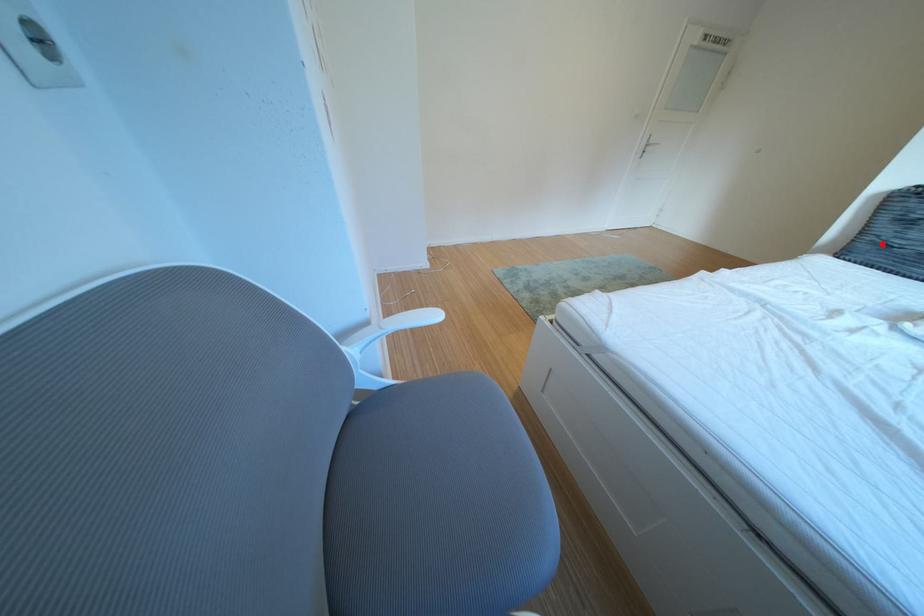
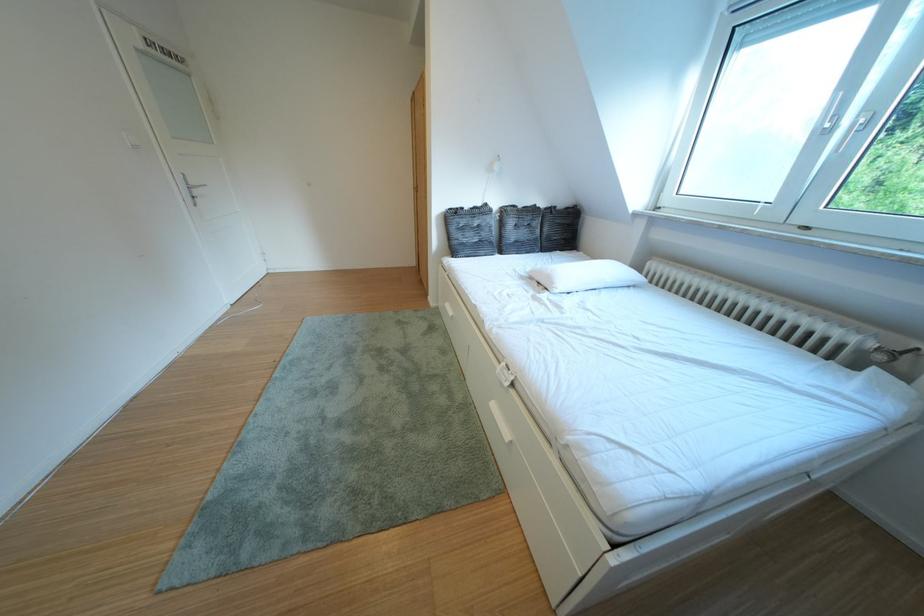
Question: I am providing you with two images of the same scene from different viewpoints. A red point is shown in image1. For the corresponding object point in image2, is it positioned nearer or farther from the camera?

Choices:
 (A) Nearer
 (B) Farther

Answer: (A)